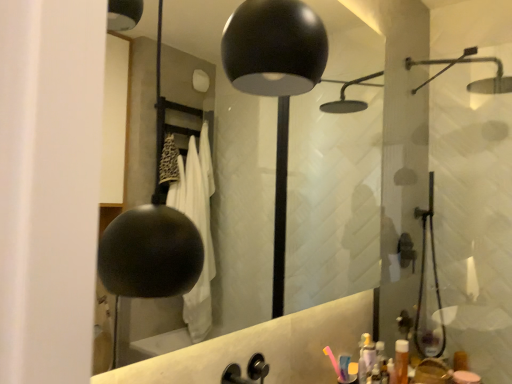
Question: Considering the positions of black matte faucet at center and pink plastic toothbrush at lower right in the image, is black matte faucet at center wider or thinner than pink plastic toothbrush at lower right?

Choices:
 (A) thin
 (B) wide

Answer: (B)

Question: From the image's perspective, is black matte faucet at center above or below pink plastic toothbrush at lower right?

Choices:
 (A) above
 (B) below

Answer: (A)

Question: Which is nearer to the translucent orange bottle at lower right?

Choices:
 (A) black matte faucet at center
 (B) pink plastic toothbrush at lower right
 (C) black matte mirror at upper center

Answer: (B)

Question: Estimate the real-world distances between objects in this image. Which object is closer to the pink plastic toothbrush at lower right?

Choices:
 (A) black matte faucet at center
 (B) black matte mirror at upper center
 (C) translucent orange bottle at lower right

Answer: (A)